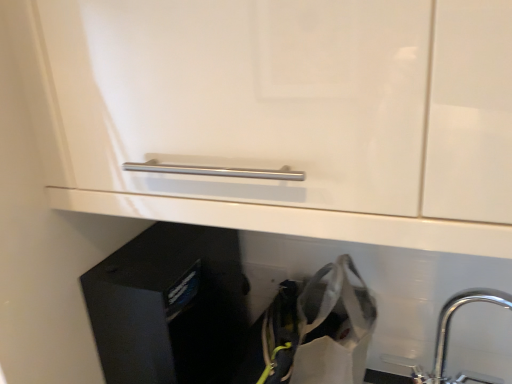
Question: Does white fabric shopping bag at lower right have a smaller size compared to black matte file cabinet at lower left?

Choices:
 (A) no
 (B) yes

Answer: (B)

Question: Is white fabric shopping bag at lower right far away from black matte file cabinet at lower left?

Choices:
 (A) no
 (B) yes

Answer: (A)

Question: Can you confirm if white fabric shopping bag at lower right is wider than black matte file cabinet at lower left?

Choices:
 (A) no
 (B) yes

Answer: (A)

Question: From the image's perspective, is white fabric shopping bag at lower right beneath black matte file cabinet at lower left?

Choices:
 (A) yes
 (B) no

Answer: (A)

Question: Is the depth of white fabric shopping bag at lower right greater than that of black matte file cabinet at lower left?

Choices:
 (A) no
 (B) yes

Answer: (A)

Question: From the image's perspective, is white fabric shopping bag at lower right over black matte file cabinet at lower left?

Choices:
 (A) yes
 (B) no

Answer: (B)

Question: From the image's perspective, is black matte file cabinet at lower left over chrome metallic tap at lower right?

Choices:
 (A) yes
 (B) no

Answer: (A)

Question: Can you confirm if black matte file cabinet at lower left is positioned to the left of chrome metallic tap at lower right?

Choices:
 (A) no
 (B) yes

Answer: (B)

Question: Is black matte file cabinet at lower left located outside chrome metallic tap at lower right?

Choices:
 (A) no
 (B) yes

Answer: (B)

Question: From a real-world perspective, is black matte file cabinet at lower left located higher than chrome metallic tap at lower right?

Choices:
 (A) yes
 (B) no

Answer: (B)

Question: Is black matte file cabinet at lower left wider than chrome metallic tap at lower right?

Choices:
 (A) no
 (B) yes

Answer: (B)

Question: Considering the relative positions of black matte file cabinet at lower left and chrome metallic tap at lower right in the image provided, is black matte file cabinet at lower left to the right of chrome metallic tap at lower right from the viewer's perspective?

Choices:
 (A) yes
 (B) no

Answer: (B)

Question: Is chrome metallic tap at lower right aimed at white fabric shopping bag at lower right?

Choices:
 (A) yes
 (B) no

Answer: (B)